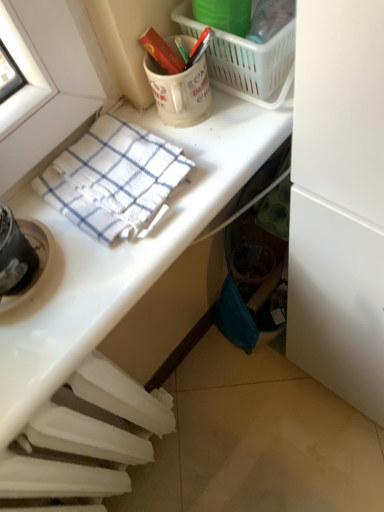
Question: Choose the correct answer: Is white matte coffee cup at upper center inside white checkered towel at upper left or outside it?

Choices:
 (A) inside
 (B) outside

Answer: (B)

Question: From the image's perspective, is white matte coffee cup at upper center above or below white checkered towel at upper left?

Choices:
 (A) below
 (B) above

Answer: (B)

Question: Estimate the real-world distances between objects in this image. Which object is farther from the white glossy towel at upper left?

Choices:
 (A) white plastic radiator at lower left
 (B) white matte coffee cup at upper center
 (C) green plastic bucket at upper center
 (D) white checkered towel at upper left
 (E) white plastic picnic basket at upper center

Answer: (C)

Question: Estimate the real-world distances between objects in this image. Which object is farther from the white plastic picnic basket at upper center?

Choices:
 (A) white matte coffee cup at upper center
 (B) green plastic bucket at upper center
 (C) white plastic radiator at lower left
 (D) white checkered towel at upper left
 (E) white glossy towel at upper left

Answer: (C)